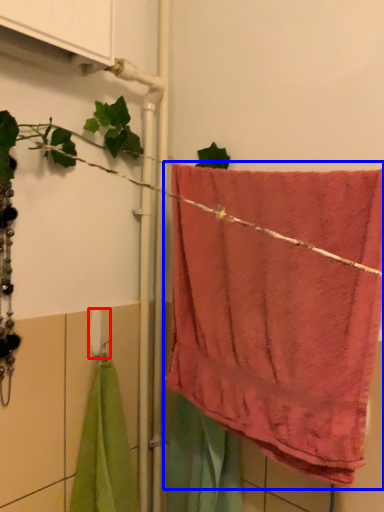
Question: Which object is further to the camera taking this photo, towel bar (highlighted by a red box) or towel (highlighted by a blue box)?

Choices:
 (A) towel bar
 (B) towel

Answer: (A)